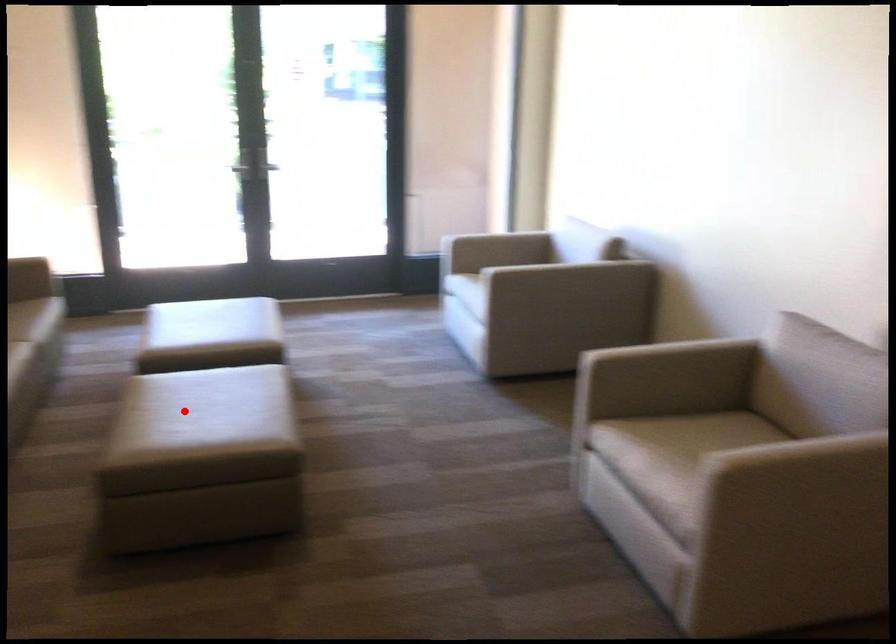
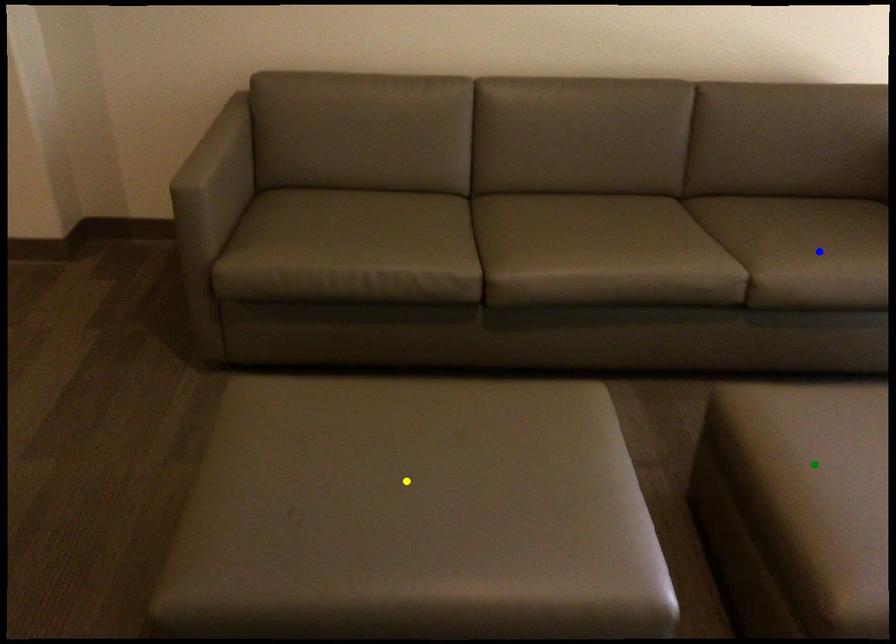
Question: I am providing you with two images of the same scene from different viewpoints. A red point is marked on the first image. You are given multiple points on the second image. Can you choose the point in image 2 that corresponds to the point in image 1?

Choices:
 (A) yellow point
 (B) green point
 (C) blue point

Answer: (A)